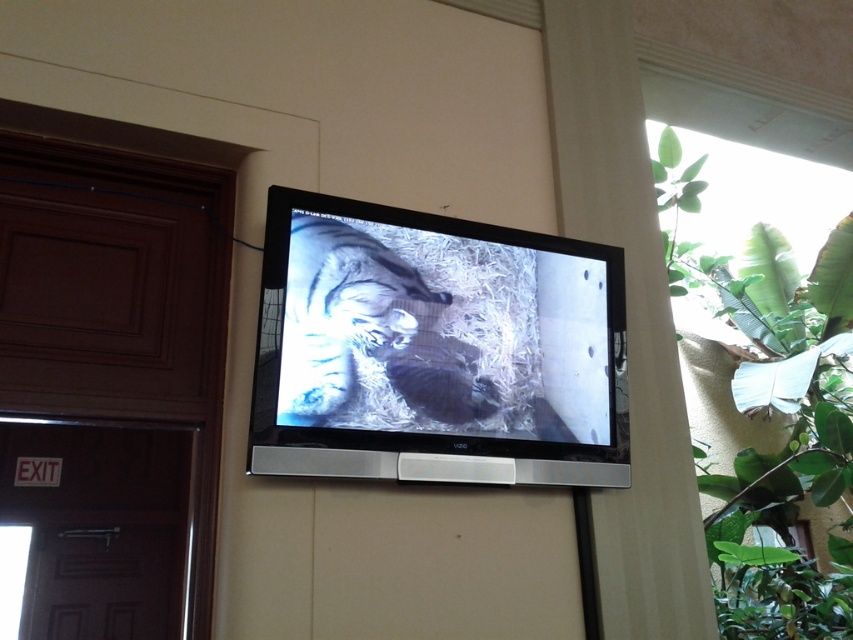
You are standing in a room with a flat screen TV and a door. There are two points marked on the wall. The first point is at coordinate (393,371) and the second point is at coordinate (775,611). If you were to walk towards the TV, which point would you encounter first?

Point (393,371) is in front of point (775,611), so you would encounter point (393,371) first when walking towards the TV.

You are standing in a room and want to reach the green leafy plant at upper right. You can only move around the matte black tv at center. Can you walk directly to the plant without going around the TV?

The matte black tv at center is closer to the viewer than green leafy plant at upper right, so you cannot walk directly to the plant without going around the TV.